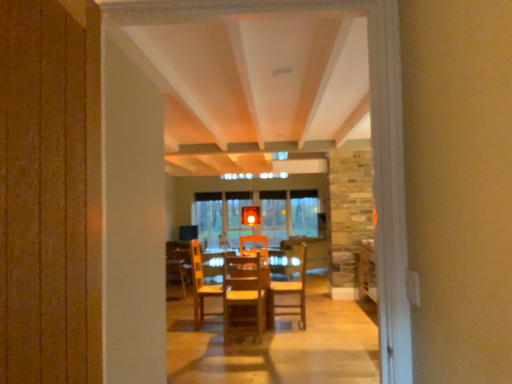
You are a GUI agent. You are given a task and a screenshot of the screen. Output one action in this format:
    pyautogui.click(x=<x>, y=<y>)
    Task: Click on the vacant area that is in front of wooden chair at center, the second chair from the left
    This screenshot has height=384, width=512.
    Given the screenshot: What is the action you would take?
    pyautogui.click(x=296, y=328)